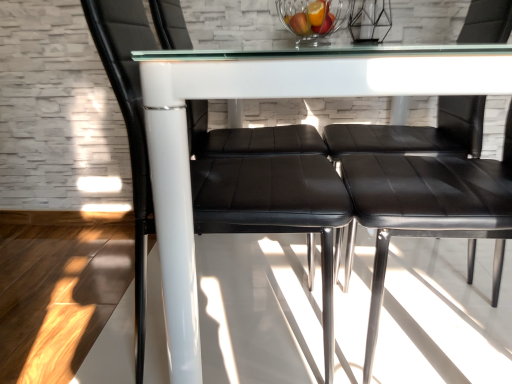
Find the location of a particular element. vacant space underneath transparent glass table at center (from a real-world perspective) is located at coordinates (307, 270).